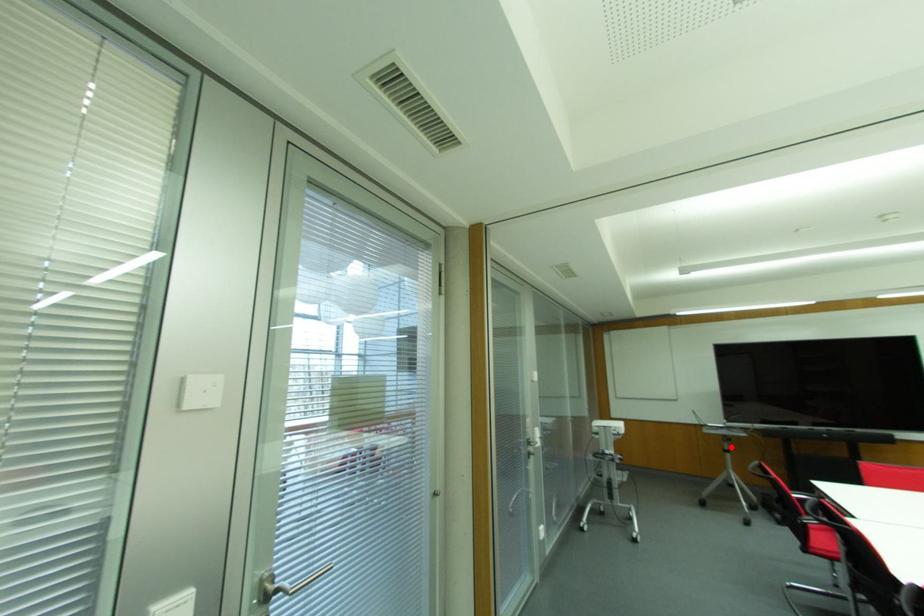
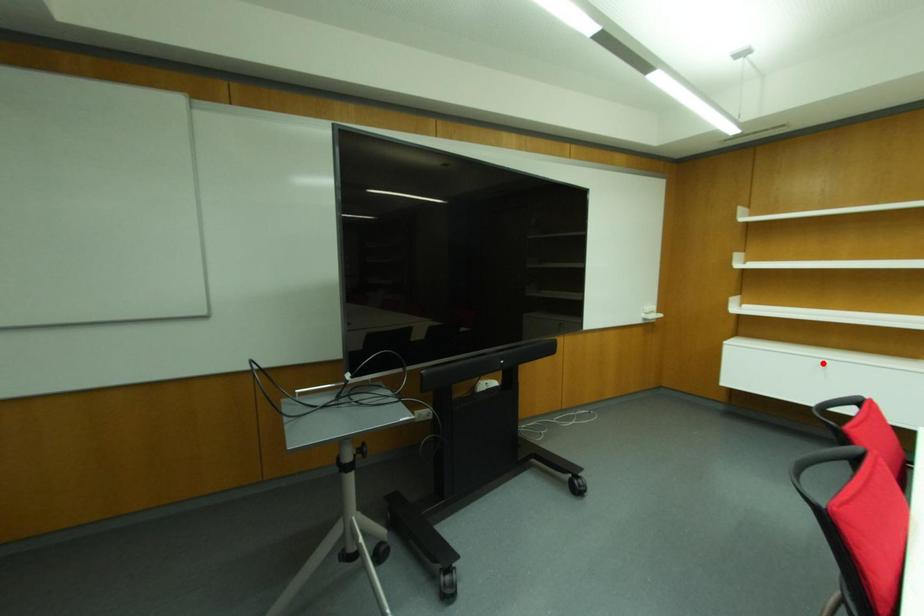
I am providing you with two images of the same scene from different viewpoints. A red point is marked on the first image and another point is marked on the second image. Do the highlighted points in image1 and image2 indicate the same real-world spot?

No